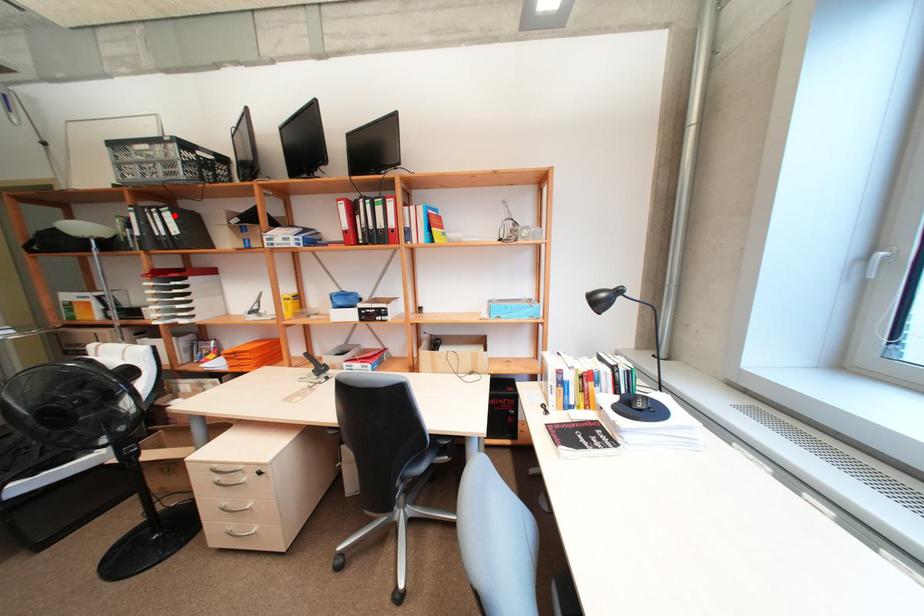
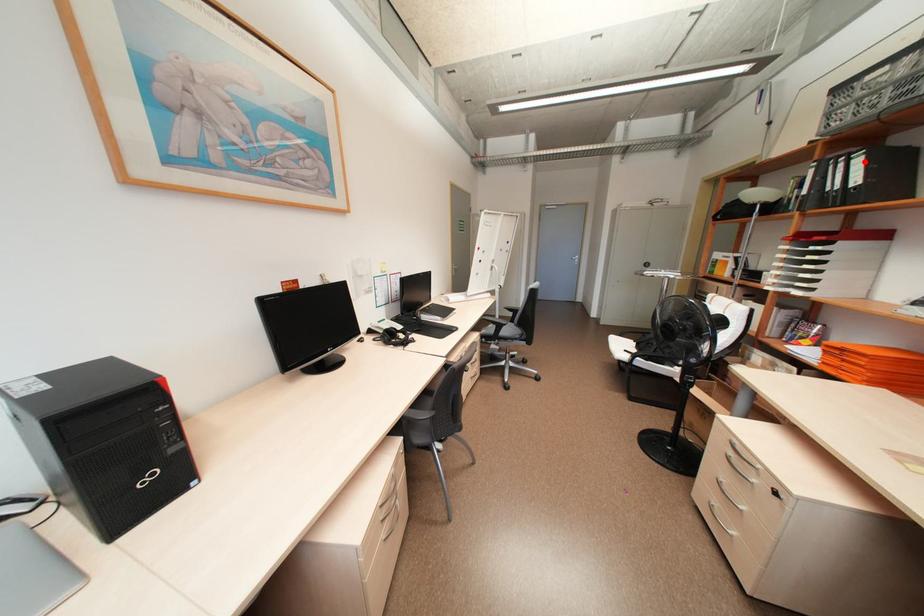
I am providing you with two images of the same scene from different viewpoints. A red point is marked on the first image and another point is marked on the second image. Are the points marked in image1 and image2 representing the same 3D position?

Yes